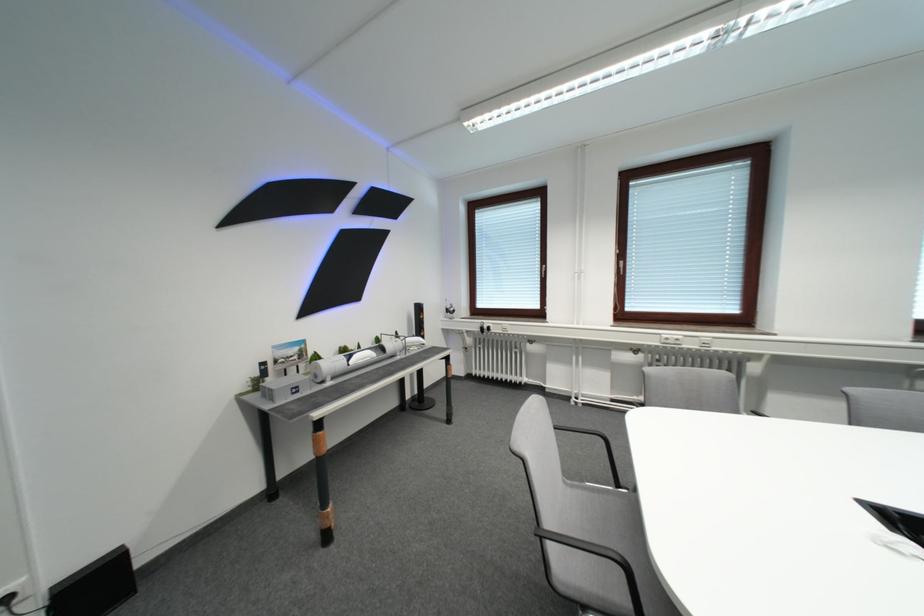
Describe the element at coordinates (611, 519) in the screenshot. I see `the chair sitting surface` at that location.